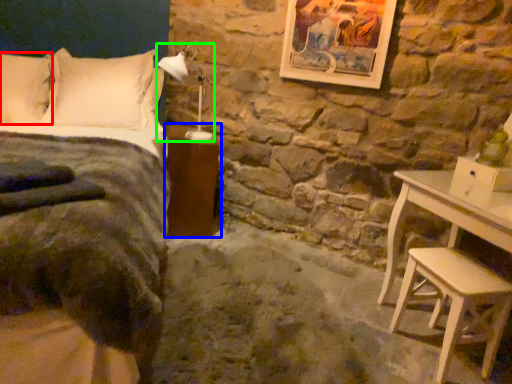
Question: Considering the real-world distances, which object is closest to pillow (highlighted by a red box)? nightstand (highlighted by a blue box) or lamp (highlighted by a green box).

Choices:
 (A) nightstand
 (B) lamp

Answer: (B)